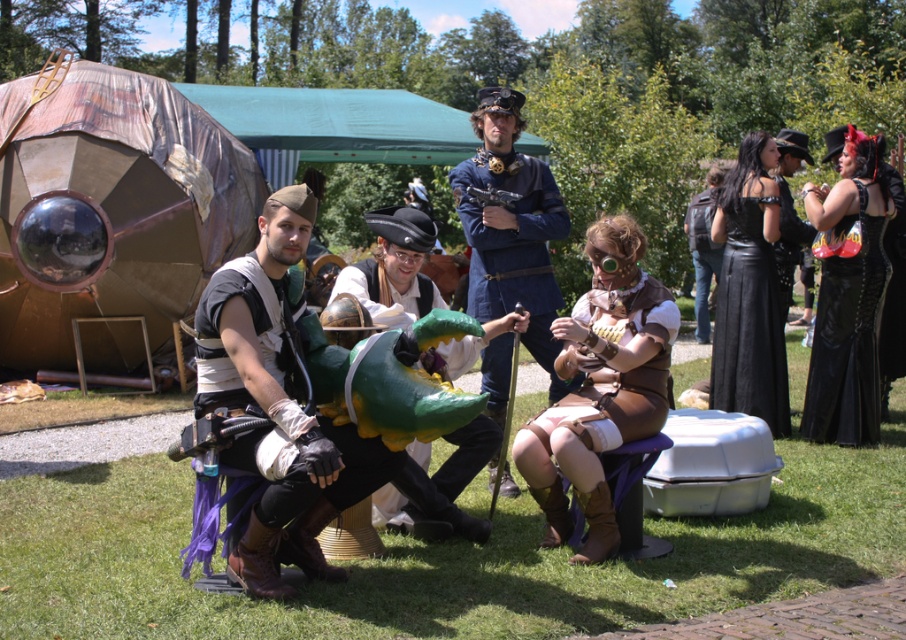
Who is shorter, black leather dress at upper right or black leather jacket at upper right?

With less height is black leather jacket at upper right.

Consider the image. Can you confirm if black leather dress at upper right is wider than black leather jacket at upper right?

Correct, the width of black leather dress at upper right exceeds that of black leather jacket at upper right.

Measure the distance between point (750, 349) and camera.

Point (750, 349) is 23.26 feet away from camera.

Find the location of a particular element. The width and height of the screenshot is (906, 640). black leather dress at upper right is located at coordinates (749, 310).

The height and width of the screenshot is (640, 906). What do you see at coordinates (600, 387) in the screenshot?
I see `brown leather vest at center` at bounding box center [600, 387].

Who is more forward, (661,321) or (882,218)?

Point (661,321)

Identify the location of brown leather vest at center. (600, 387).

Image resolution: width=906 pixels, height=640 pixels. I want to click on brown leather vest at center, so click(600, 387).

Is point (845, 403) positioned in front of point (811, 300)?

That is True.

Where is `black leather dress at right`? black leather dress at right is located at coordinates (847, 333).